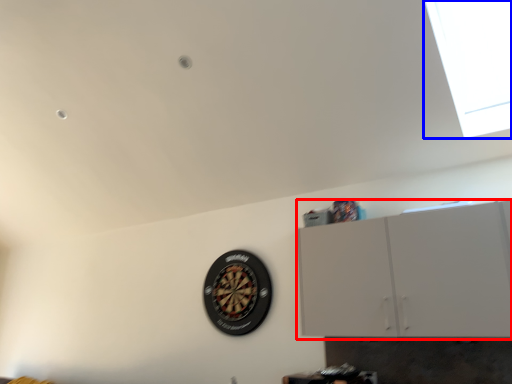
Question: Which of the following is the closest to the observer, cabinetry (highlighted by a red box) or window (highlighted by a blue box)?

Choices:
 (A) cabinetry
 (B) window

Answer: (B)